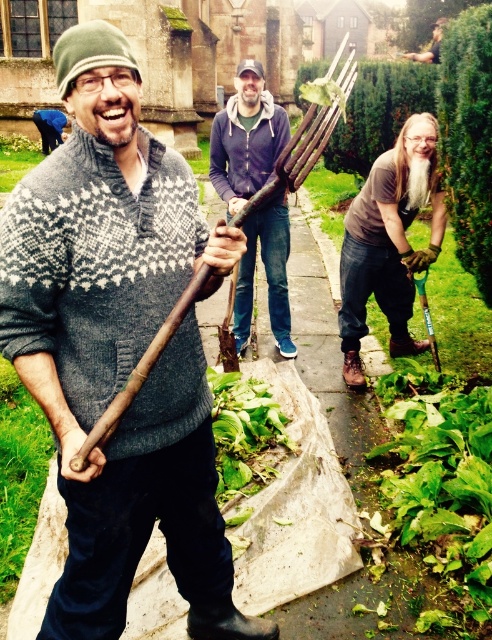
Does knitted gray sweater at center have a lesser height compared to green leafy vegetable at center?

Incorrect, knitted gray sweater at center's height does not fall short of green leafy vegetable at center's.

Can you confirm if knitted gray sweater at center is smaller than green leafy vegetable at center?

Incorrect, knitted gray sweater at center is not smaller in size than green leafy vegetable at center.

Identify the location of knitted gray sweater at center. The image size is (492, 640). (119, 346).

How much distance is there between green leafy vegetable at lower right and green leafy vegetable at center?

green leafy vegetable at lower right and green leafy vegetable at center are 33.09 inches apart.

The height and width of the screenshot is (640, 492). I want to click on green leafy vegetable at lower right, so click(441, 486).

Is point (389, 490) positioned before point (224, 456)?

Yes, it is.

Where is `green leafy vegetable at lower right`? green leafy vegetable at lower right is located at coordinates (441, 486).

Is knitted gray sweater at center taller than brown leather gloves at lower right?

Indeed, knitted gray sweater at center has a greater height compared to brown leather gloves at lower right.

Who is more forward, [172,244] or [361,372]?

Positioned in front is point [172,244].

This screenshot has width=492, height=640. I want to click on knitted gray sweater at center, so click(x=119, y=346).